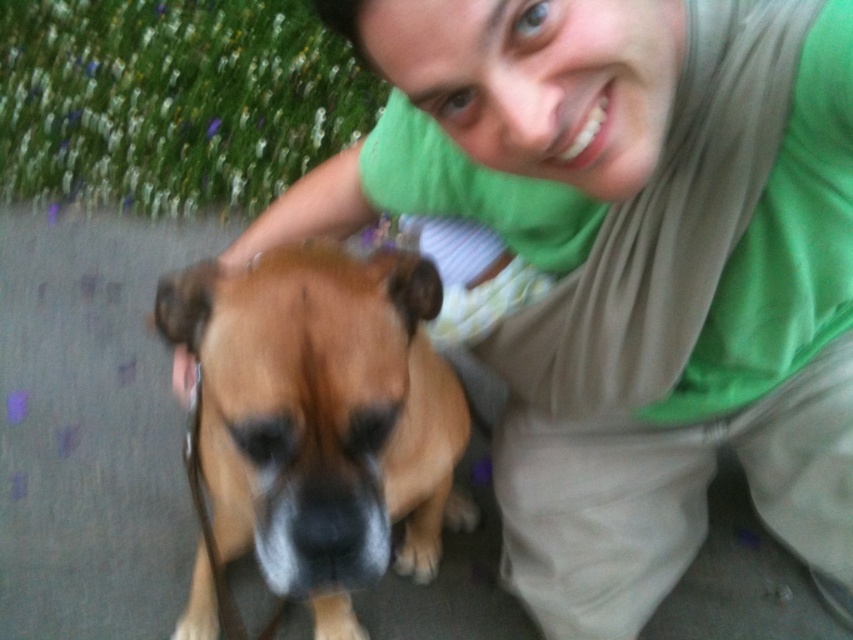
Question: Which object appears farthest from the camera in this image?

Choices:
 (A) green fabric shirt at upper center
 (B) brown fur dog at center

Answer: (B)

Question: From the image, what is the correct spatial relationship of green fabric shirt at upper center in relation to brown fur dog at center?

Choices:
 (A) above
 (B) below

Answer: (A)

Question: Which point is closer to the camera?

Choices:
 (A) (677, 401)
 (B) (392, 522)

Answer: (A)

Question: Is the position of green fabric shirt at upper center less distant than that of brown fur dog at center?

Choices:
 (A) no
 (B) yes

Answer: (B)

Question: Which point is farther to the camera?

Choices:
 (A) (308, 250)
 (B) (387, 186)

Answer: (B)

Question: Is green fabric shirt at upper center below brown fur dog at center?

Choices:
 (A) no
 (B) yes

Answer: (A)